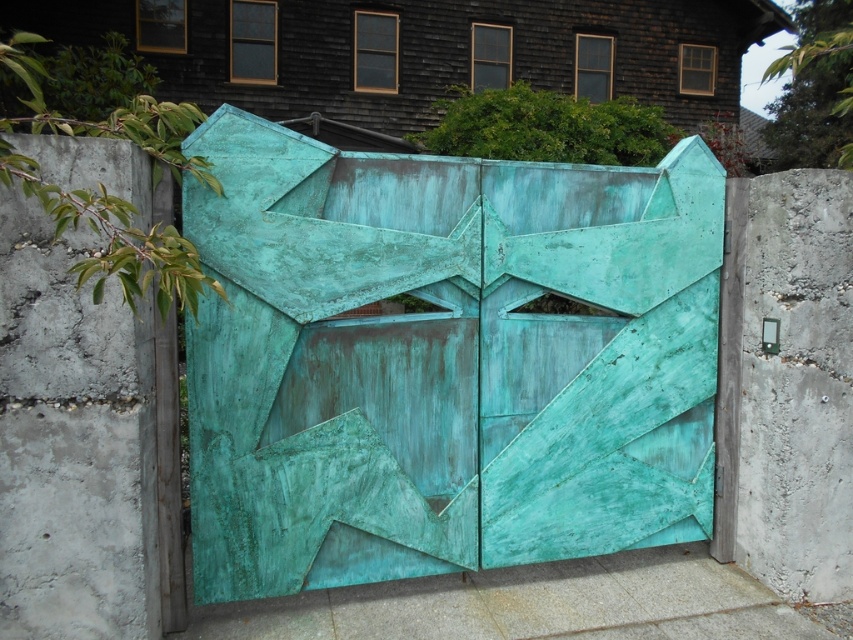
Question: Which of these objects is positioned farthest from the green patina concrete at left?

Choices:
 (A) green patina gate at center
 (B) smooth concrete slab at bottom center

Answer: (B)

Question: Which point is farther from the camera taking this photo?

Choices:
 (A) (113, 292)
 (B) (469, 509)
 (C) (392, 595)

Answer: (C)

Question: Does green patina gate at center have a larger size compared to green patina concrete at left?

Choices:
 (A) no
 (B) yes

Answer: (B)

Question: Which object is positioned farthest from the green patina gate at center?

Choices:
 (A) green patina concrete at left
 (B) smooth concrete slab at bottom center

Answer: (A)

Question: Is green patina gate at center further to the viewer compared to smooth concrete slab at bottom center?

Choices:
 (A) yes
 (B) no

Answer: (B)

Question: Can you confirm if green patina gate at center is thinner than green patina concrete at left?

Choices:
 (A) yes
 (B) no

Answer: (B)